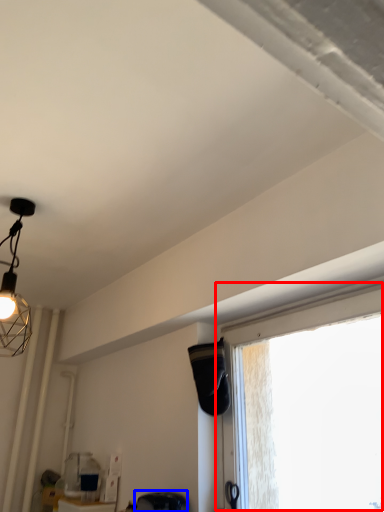
Question: Which object appears farthest to the camera in this image, window (highlighted by a red box) or swivel chair (highlighted by a blue box)?

Choices:
 (A) window
 (B) swivel chair

Answer: (B)